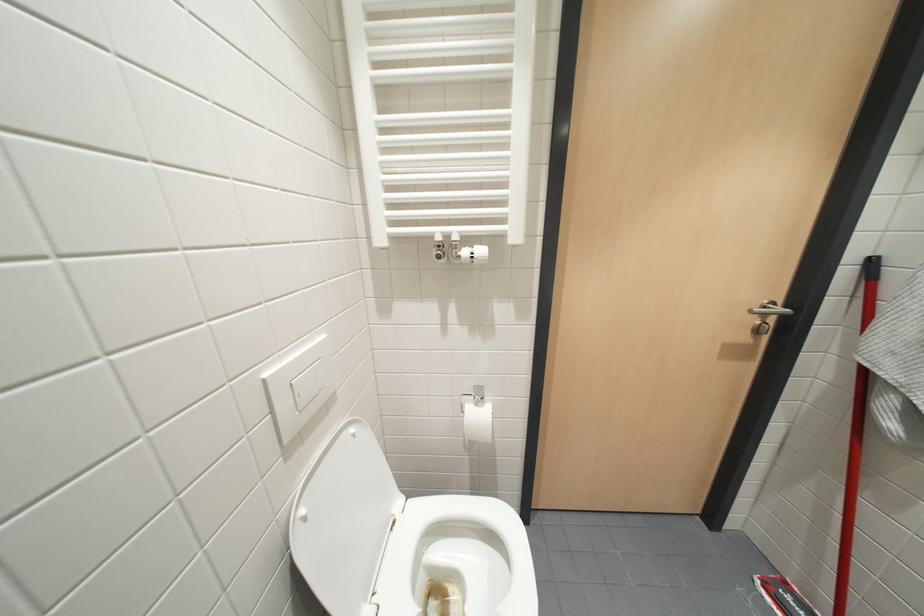
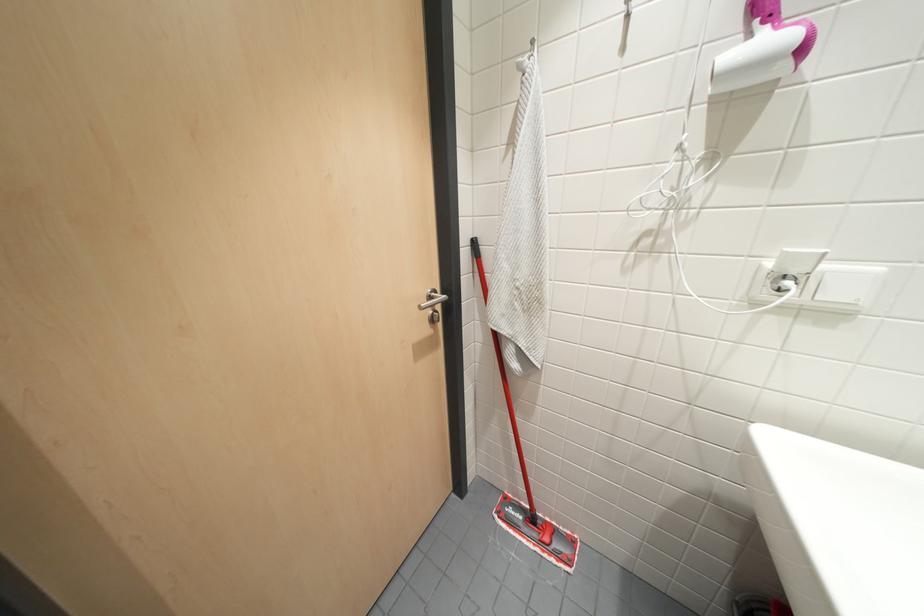
Question: Based on the continuous images, in which direction is the camera rotating? Reply with the corresponding letter.

Choices:
 (A) Left
 (B) Right
 (C) Up
 (D) Down

Answer: (B)